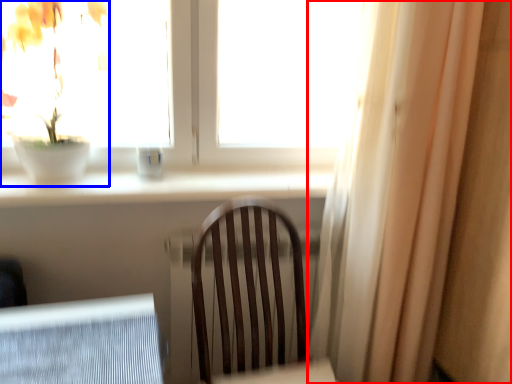
Question: Which point is further to the camera, curtain (highlighted by a red box) or houseplant (highlighted by a blue box)?

Choices:
 (A) curtain
 (B) houseplant

Answer: (B)